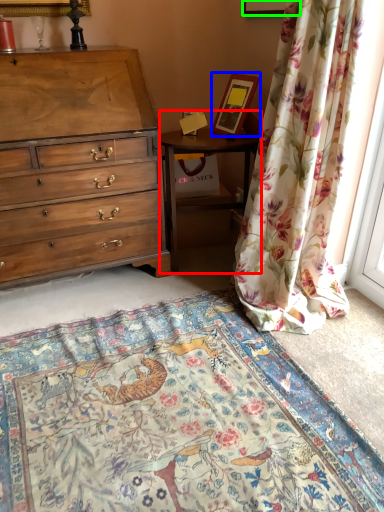
Question: Which is farther away from nightstand (highlighted by a red box)? picture frame (highlighted by a blue box) or picture frame (highlighted by a green box)?

Choices:
 (A) picture frame
 (B) picture frame

Answer: (B)